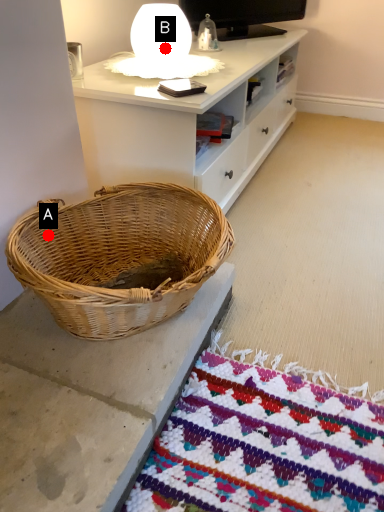
Question: Two points are circled on the image, labeled by A and B beside each circle. Among these points, which one is farthest from the camera?

Choices:
 (A) A is further
 (B) B is further

Answer: (B)